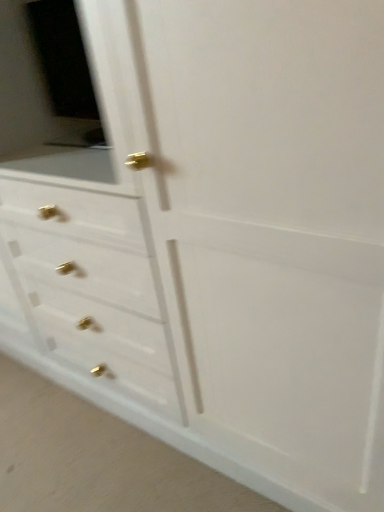
Image resolution: width=384 pixels, height=512 pixels. What are the coordinates of `matte white medicine cabinet at upper left` in the screenshot? It's located at (55, 96).

What do you see at coordinates (55, 96) in the screenshot?
I see `matte white medicine cabinet at upper left` at bounding box center [55, 96].

Identify the location of matte white medicine cabinet at upper left. (55, 96).